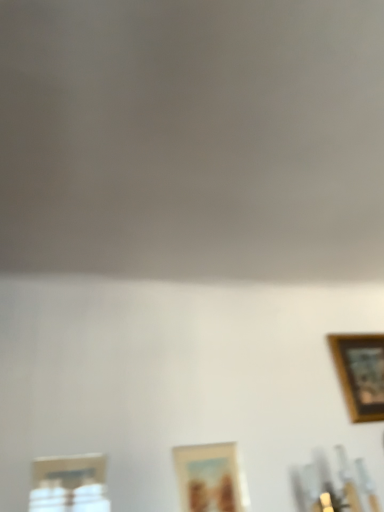
The image size is (384, 512). What do you see at coordinates (360, 373) in the screenshot?
I see `wooden framed picture at upper right, arranged as the third picture frame when viewed from the front` at bounding box center [360, 373].

Where is `wooden framed picture at upper right, which appears as the first picture frame when viewed from the back`? This screenshot has width=384, height=512. wooden framed picture at upper right, which appears as the first picture frame when viewed from the back is located at coordinates (360, 373).

Is metallic silver picture frame at lower left, which ranks as the first picture frame in front-to-back order, a part of wooden framed picture at upper right, which is the first picture frame in right-to-left order?

Definitely not — metallic silver picture frame at lower left, which ranks as the first picture frame in front-to-back order, is not inside wooden framed picture at upper right, which is the first picture frame in right-to-left order.

Is wooden framed picture at upper right, arranged as the third picture frame when viewed from the front, not close to metallic silver picture frame at lower left, the 3th picture frame when ordered from back to front?

Absolutely, wooden framed picture at upper right, arranged as the third picture frame when viewed from the front, is distant from metallic silver picture frame at lower left, the 3th picture frame when ordered from back to front.

In order to click on picture frame that is the 2nd object to the left of the wooden framed picture at upper right, which appears as the first picture frame when viewed from the back, starting at the anchor in this screenshot , I will do `click(69, 484)`.

Considering the relative positions of wooden framed picture at upper right, which appears as the first picture frame when viewed from the back, and metallic silver picture frame at lower left, which is the third picture frame from right to left, in the image provided, is wooden framed picture at upper right, which appears as the first picture frame when viewed from the back, to the right of metallic silver picture frame at lower left, which is the third picture frame from right to left, from the viewer's perspective?

Yes.

Based on their positions, is metallic silver picture frame at lower left, which is the third picture frame from right to left, located to the left or right of wooden picture frame at lower center, which ranks as the second picture frame in right-to-left order?

Clearly, metallic silver picture frame at lower left, which is the third picture frame from right to left, is on the left of wooden picture frame at lower center, which ranks as the second picture frame in right-to-left order, in the image.

From the image's perspective, relative to wooden picture frame at lower center, positioned as the 2th picture frame in front-to-back order, is metallic silver picture frame at lower left, which ranks as the first picture frame in front-to-back order, above or below?

Based on their image positions, metallic silver picture frame at lower left, which ranks as the first picture frame in front-to-back order, is located above wooden picture frame at lower center, positioned as the 2th picture frame in front-to-back order.

Does metallic silver picture frame at lower left, the 3th picture frame when ordered from back to front, have a greater width compared to wooden picture frame at lower center, which is the second picture frame from back to front?

Yes.

Between metallic silver picture frame at lower left, the 3th picture frame when ordered from back to front, and wooden picture frame at lower center, which ranks as the second picture frame in right-to-left order, which one is positioned behind?

wooden picture frame at lower center, which ranks as the second picture frame in right-to-left order, is further from the camera.

Is wooden picture frame at lower center, which is the second picture frame from back to front, wider than wooden framed picture at upper right, marked as the 3th picture frame in a left-to-right arrangement?

In fact, wooden picture frame at lower center, which is the second picture frame from back to front, might be narrower than wooden framed picture at upper right, marked as the 3th picture frame in a left-to-right arrangement.

Is wooden picture frame at lower center, which ranks as the second picture frame in right-to-left order, further to the viewer compared to wooden framed picture at upper right, marked as the 3th picture frame in a left-to-right arrangement?

That is False.

Is wooden picture frame at lower center, the 2th picture frame when ordered from left to right, situated inside wooden framed picture at upper right, which appears as the first picture frame when viewed from the back, or outside?

wooden picture frame at lower center, the 2th picture frame when ordered from left to right, is located beyond the bounds of wooden framed picture at upper right, which appears as the first picture frame when viewed from the back.

Could you tell me if wooden picture frame at lower center, which is the second picture frame from back to front, is facing wooden framed picture at upper right, arranged as the third picture frame when viewed from the front?

No, wooden picture frame at lower center, which is the second picture frame from back to front, is not turned towards wooden framed picture at upper right, arranged as the third picture frame when viewed from the front.

Where is `picture frame lying in front of the wooden picture frame at lower center, positioned as the 2th picture frame in front-to-back order`? The height and width of the screenshot is (512, 384). picture frame lying in front of the wooden picture frame at lower center, positioned as the 2th picture frame in front-to-back order is located at coordinates [x=69, y=484].

Is wooden picture frame at lower center, which ranks as the second picture frame in right-to-left order, to the left or to the right of metallic silver picture frame at lower left, which ranks as the first picture frame in front-to-back order, in the image?

Clearly, wooden picture frame at lower center, which ranks as the second picture frame in right-to-left order, is on the right of metallic silver picture frame at lower left, which ranks as the first picture frame in front-to-back order, in the image.

Based on the photo, is wooden picture frame at lower center, which ranks as the second picture frame in right-to-left order, far away from metallic silver picture frame at lower left, placed as the 1th picture frame when sorted from left to right?

wooden picture frame at lower center, which ranks as the second picture frame in right-to-left order, is actually quite close to metallic silver picture frame at lower left, placed as the 1th picture frame when sorted from left to right.

Can you tell me how much wooden picture frame at lower center, positioned as the 2th picture frame in front-to-back order, and metallic silver picture frame at lower left, which ranks as the first picture frame in front-to-back order, differ in facing direction?

0.00219 degrees separate the facing orientations of wooden picture frame at lower center, positioned as the 2th picture frame in front-to-back order, and metallic silver picture frame at lower left, which ranks as the first picture frame in front-to-back order.

Considering the relative positions of metallic silver picture frame at lower left, the 3th picture frame when ordered from back to front, and wooden framed picture at upper right, arranged as the third picture frame when viewed from the front, in the image provided, is metallic silver picture frame at lower left, the 3th picture frame when ordered from back to front, to the left of wooden framed picture at upper right, arranged as the third picture frame when viewed from the front, from the viewer's perspective?

Yes, metallic silver picture frame at lower left, the 3th picture frame when ordered from back to front, is to the left of wooden framed picture at upper right, arranged as the third picture frame when viewed from the front.

Considering the positions of point (84, 455) and point (375, 342), is point (84, 455) closer or farther from the camera than point (375, 342)?

Point (84, 455) is positioned closer to the camera compared to point (375, 342).

Does metallic silver picture frame at lower left, the 3th picture frame when ordered from back to front, lie in front of wooden framed picture at upper right, marked as the 3th picture frame in a left-to-right arrangement?

Yes, metallic silver picture frame at lower left, the 3th picture frame when ordered from back to front, is in front of wooden framed picture at upper right, marked as the 3th picture frame in a left-to-right arrangement.

Is metallic silver picture frame at lower left, which is the third picture frame from right to left, looking in the opposite direction of wooden framed picture at upper right, which appears as the first picture frame when viewed from the back?

No, metallic silver picture frame at lower left, which is the third picture frame from right to left, is not facing the opposite direction of wooden framed picture at upper right, which appears as the first picture frame when viewed from the back.

Considering the sizes of objects wooden framed picture at upper right, which appears as the first picture frame when viewed from the back, and wooden picture frame at lower center, which ranks as the second picture frame in right-to-left order, in the image provided, who is wider, wooden framed picture at upper right, which appears as the first picture frame when viewed from the back, or wooden picture frame at lower center, which ranks as the second picture frame in right-to-left order,?

wooden framed picture at upper right, which appears as the first picture frame when viewed from the back, is wider.

Measure the distance between wooden framed picture at upper right, arranged as the third picture frame when viewed from the front, and wooden picture frame at lower center, positioned as the 2th picture frame in front-to-back order.

The distance of wooden framed picture at upper right, arranged as the third picture frame when viewed from the front, from wooden picture frame at lower center, positioned as the 2th picture frame in front-to-back order, is 25.56 inches.

From a real-world perspective, is wooden framed picture at upper right, which is the first picture frame in right-to-left order, positioned under wooden picture frame at lower center, which is the second picture frame from back to front, based on gravity?

Incorrect, from a real-world perspective, wooden framed picture at upper right, which is the first picture frame in right-to-left order, is higher than wooden picture frame at lower center, which is the second picture frame from back to front.

Can you see wooden framed picture at upper right, which is the first picture frame in right-to-left order, touching wooden picture frame at lower center, positioned as the 2th picture frame in front-to-back order?

No.

Starting from the wooden framed picture at upper right, marked as the 3th picture frame in a left-to-right arrangement, which picture frame is the 2nd one to the left? Please provide its 2D coordinates.

[(69, 484)]

Image resolution: width=384 pixels, height=512 pixels. What are the coordinates of `the 1st picture frame behind the metallic silver picture frame at lower left, which ranks as the first picture frame in front-to-back order, starting your count from the anchor` in the screenshot? It's located at (209, 478).

Which object lies further to the anchor point wooden picture frame at lower center, which ranks as the second picture frame in right-to-left order, wooden framed picture at upper right, which appears as the first picture frame when viewed from the back, or metallic silver picture frame at lower left, which ranks as the first picture frame in front-to-back order?

wooden framed picture at upper right, which appears as the first picture frame when viewed from the back, lies further to wooden picture frame at lower center, which ranks as the second picture frame in right-to-left order, than the other object.

From the image, which object appears to be farther from wooden picture frame at lower center, positioned as the 2th picture frame in front-to-back order, metallic silver picture frame at lower left, which ranks as the first picture frame in front-to-back order, or wooden framed picture at upper right, which appears as the first picture frame when viewed from the back?

wooden framed picture at upper right, which appears as the first picture frame when viewed from the back, is further to wooden picture frame at lower center, positioned as the 2th picture frame in front-to-back order.

Looking at this image, from the image, which object appears to be farther from metallic silver picture frame at lower left, which is the third picture frame from right to left, wooden picture frame at lower center, which is the second picture frame from back to front, or wooden framed picture at upper right, marked as the 3th picture frame in a left-to-right arrangement?

Based on the image, wooden framed picture at upper right, marked as the 3th picture frame in a left-to-right arrangement, appears to be further to metallic silver picture frame at lower left, which is the third picture frame from right to left.

Looking at the image, which one is located closer to wooden framed picture at upper right, arranged as the third picture frame when viewed from the front, wooden picture frame at lower center, which ranks as the second picture frame in right-to-left order, or metallic silver picture frame at lower left, which ranks as the first picture frame in front-to-back order?

wooden picture frame at lower center, which ranks as the second picture frame in right-to-left order, is closer to wooden framed picture at upper right, arranged as the third picture frame when viewed from the front.

Looking at the image, which one is located further to wooden framed picture at upper right, which is the first picture frame in right-to-left order, metallic silver picture frame at lower left, which is the third picture frame from right to left, or wooden picture frame at lower center, positioned as the 2th picture frame in front-to-back order?

Based on the image, metallic silver picture frame at lower left, which is the third picture frame from right to left, appears to be further to wooden framed picture at upper right, which is the first picture frame in right-to-left order.

Considering their positions, is wooden framed picture at upper right, which appears as the first picture frame when viewed from the back, positioned closer to metallic silver picture frame at lower left, placed as the 1th picture frame when sorted from left to right, than wooden picture frame at lower center, which ranks as the second picture frame in right-to-left order?

wooden picture frame at lower center, which ranks as the second picture frame in right-to-left order, lies closer to metallic silver picture frame at lower left, placed as the 1th picture frame when sorted from left to right, than the other object.

Where is `picture frame situated between metallic silver picture frame at lower left, which is the third picture frame from right to left, and wooden framed picture at upper right, marked as the 3th picture frame in a left-to-right arrangement, from left to right`? Image resolution: width=384 pixels, height=512 pixels. picture frame situated between metallic silver picture frame at lower left, which is the third picture frame from right to left, and wooden framed picture at upper right, marked as the 3th picture frame in a left-to-right arrangement, from left to right is located at coordinates (209, 478).